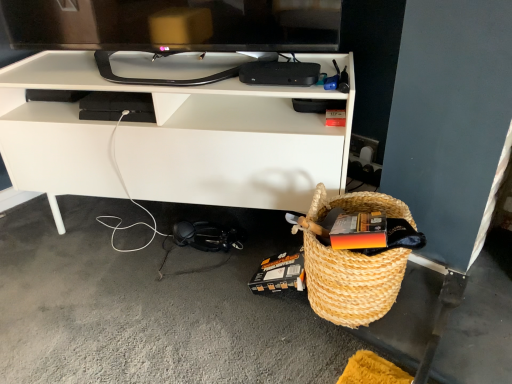
Locate an element on the screen. The height and width of the screenshot is (384, 512). free space on the front side of white matte desk at center is located at coordinates (158, 311).